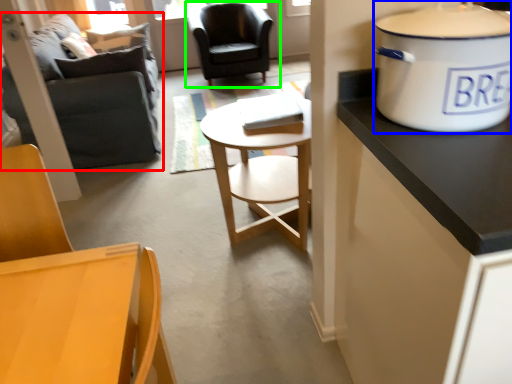
Question: Which object is the closest to the studio couch (highlighted by a red box)? Choose among these: cooker (highlighted by a blue box) or chair (highlighted by a green box).

Choices:
 (A) cooker
 (B) chair

Answer: (B)